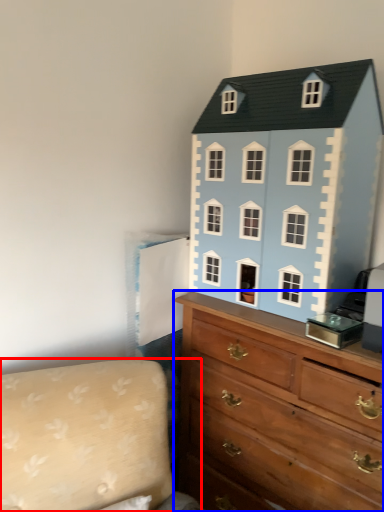
Question: Which of the following is the farthest to the observer, couch (highlighted by a red box) or chest of drawers (highlighted by a blue box)?

Choices:
 (A) couch
 (B) chest of drawers

Answer: (B)